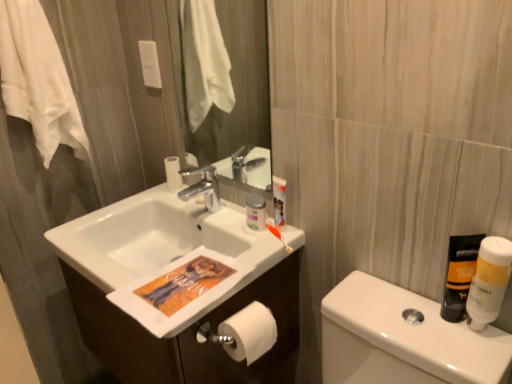
You are a GUI agent. You are given a task and a screenshot of the screen. Output one action in this format:
    pyautogui.click(x=<x>, y=<y>)
    Task: Click on the free space in front of translucent plastic bottle at right, the first mouthwash when ordered from left to right
    This screenshot has width=512, height=384.
    Given the screenshot: What is the action you would take?
    pyautogui.click(x=459, y=345)